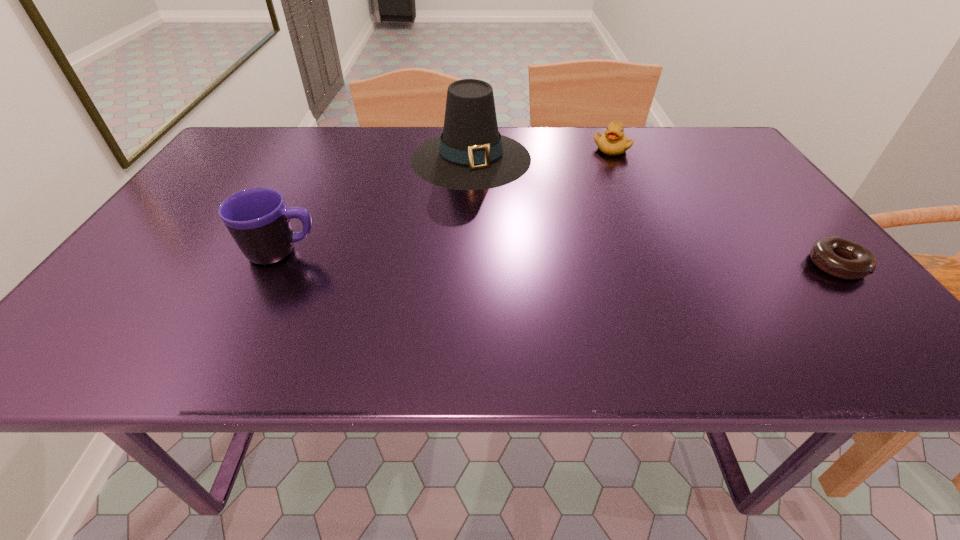
I want to click on vacant space situated on the front-facing side of the hat, so click(489, 220).

Where is `blank area located 0.330m on the front-facing side of the hat`? The height and width of the screenshot is (540, 960). blank area located 0.330m on the front-facing side of the hat is located at coordinates (505, 280).

Image resolution: width=960 pixels, height=540 pixels. I want to click on vacant position located on the front-facing side of the hat, so point(491,228).

Where is `free space located 0.070m at the beak of the duckling`? The image size is (960, 540). free space located 0.070m at the beak of the duckling is located at coordinates (597, 167).

Where is `vacant space located at the beak of the duckling`? vacant space located at the beak of the duckling is located at coordinates (561, 217).

Where is `blank space located 0.390m at the beak of the duckling`? blank space located 0.390m at the beak of the duckling is located at coordinates (550, 231).

You are a GUI agent. You are given a task and a screenshot of the screen. Output one action in this format:
    pyautogui.click(x=<x>, y=<y>)
    Task: Click on the hat at the far edge
    
    Given the screenshot: What is the action you would take?
    (471, 154)

Where is `duckling that is at the far edge`? The image size is (960, 540). duckling that is at the far edge is located at coordinates (614, 141).

I want to click on object that is at the right edge, so click(x=839, y=257).

Where is `free region at the far edge of the desktop`? This screenshot has height=540, width=960. free region at the far edge of the desktop is located at coordinates (409, 136).